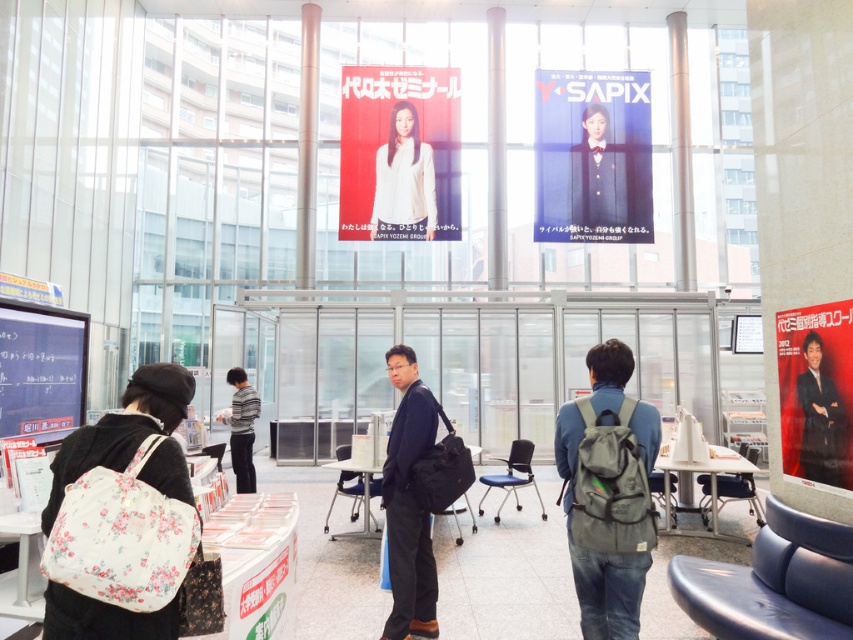
Please provide the exact coordinates of the gray fabric backpack at center in the image. The coordinates should be in the format of a point with two decimal places separated by a comma.

Result: The gray fabric backpack at center is located at point (608, 493).

You are organizing an event and need to place a large banner that requires a space of at least 2 meters in width. Given the scene described, which poster among the white matte poster at upper center and the red glossy poster at right would be more suitable for hanging the banner next to, and why?

The white matte poster at upper center is larger in size than the red glossy poster at right, so it would be more suitable for hanging the banner next to because it likely has more adjacent space available.